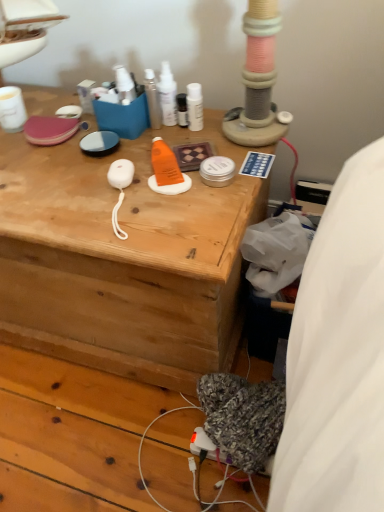
Where is `empty space that is ontop of wooden desk at center (from a real-world perspective)`? The height and width of the screenshot is (512, 384). empty space that is ontop of wooden desk at center (from a real-world perspective) is located at coordinates (100, 158).